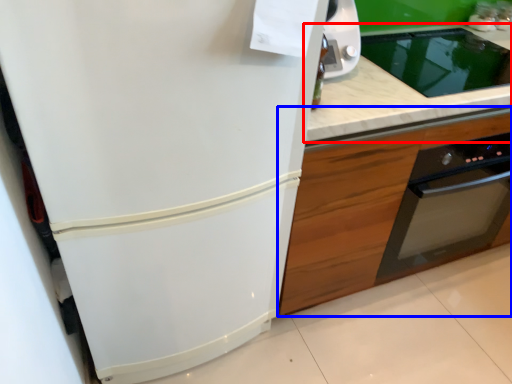
Question: Which of the following is the closest to the observer, countertop (highlighted by a red box) or cabinetry (highlighted by a blue box)?

Choices:
 (A) countertop
 (B) cabinetry

Answer: (A)